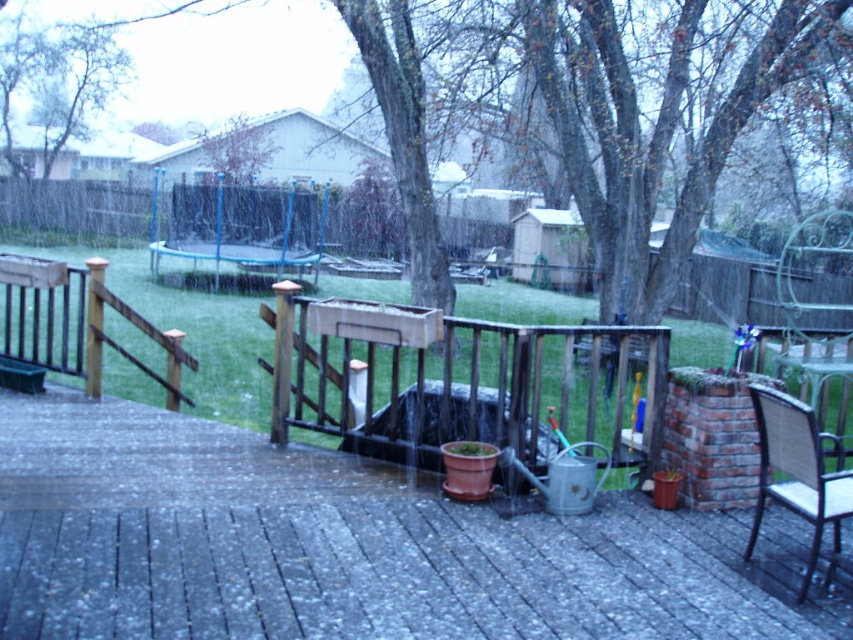
Question: Where is smooth concrete deck at center located in relation to woven wicker chair at lower right in the image?

Choices:
 (A) left
 (B) right

Answer: (A)

Question: Can you confirm if smooth concrete deck at center is positioned below woven wicker chair at lower right?

Choices:
 (A) no
 (B) yes

Answer: (B)

Question: Which object appears farthest from the camera in this image?

Choices:
 (A) smooth concrete deck at center
 (B) woven wicker chair at lower right

Answer: (B)

Question: Does smooth concrete deck at center have a smaller size compared to woven wicker chair at lower right?

Choices:
 (A) yes
 (B) no

Answer: (B)

Question: Which point is closer to the camera?

Choices:
 (A) woven wicker chair at lower right
 (B) smooth concrete deck at center

Answer: (B)